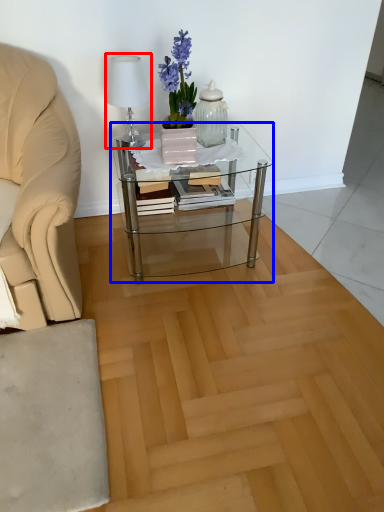
Question: Which point is further to the camera, table lamp (highlighted by a red box) or coffee table (highlighted by a blue box)?

Choices:
 (A) table lamp
 (B) coffee table

Answer: (B)